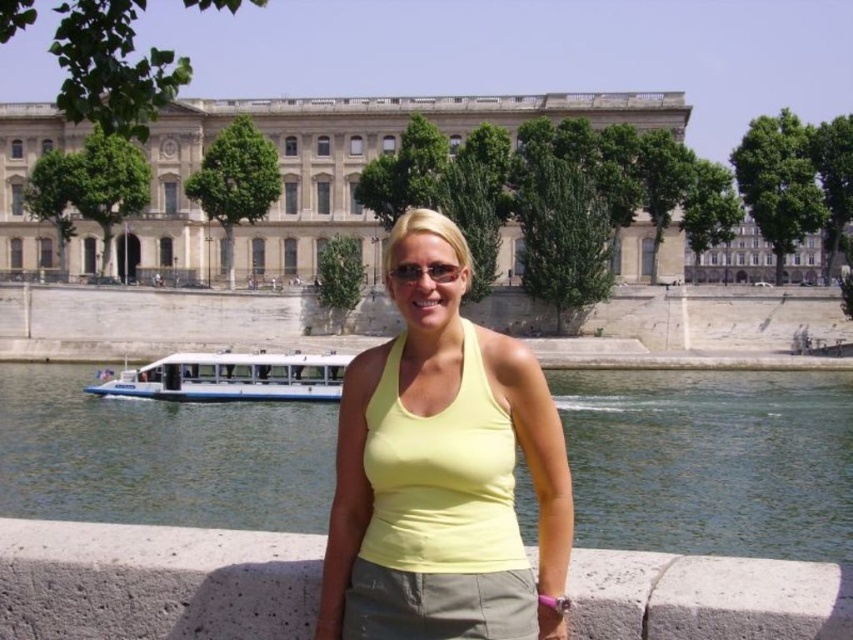
Question: Which of the following is the farthest from the observer?

Choices:
 (A) beige stone building at center
 (B) green water at center

Answer: (A)

Question: Can you confirm if beige stone building at center is wider than white matte boat at lower left?

Choices:
 (A) no
 (B) yes

Answer: (B)

Question: Which object is farther from the camera taking this photo?

Choices:
 (A) matte black sunglasses at center
 (B) white matte boat at lower left

Answer: (B)

Question: Estimate the real-world distances between objects in this image. Which object is closer to the white matte boat at lower left?

Choices:
 (A) matte black sunglasses at center
 (B) green water at center

Answer: (B)

Question: Where is green water at center located in relation to white matte boat at lower left in the image?

Choices:
 (A) right
 (B) left

Answer: (A)

Question: Can you confirm if green water at center is smaller than yellow matte tank top at center?

Choices:
 (A) no
 (B) yes

Answer: (A)